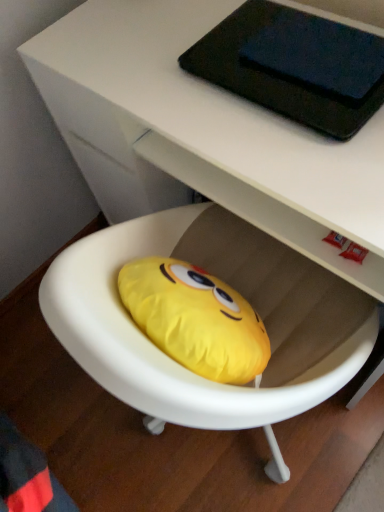
Question: Can you confirm if black matte tablet at upper center is smaller than yellow fabric bean bag at center?

Choices:
 (A) no
 (B) yes

Answer: (B)

Question: From a real-world perspective, is black matte tablet at upper center physically above yellow fabric bean bag at center?

Choices:
 (A) yes
 (B) no

Answer: (A)

Question: Is black matte tablet at upper center to the left of yellow fabric bean bag at center from the viewer's perspective?

Choices:
 (A) no
 (B) yes

Answer: (A)

Question: From a real-world perspective, is black matte tablet at upper center below yellow fabric bean bag at center?

Choices:
 (A) yes
 (B) no

Answer: (B)

Question: Is black matte tablet at upper center wider than yellow fabric bean bag at center?

Choices:
 (A) yes
 (B) no

Answer: (B)

Question: Could you tell me if black matte tablet at upper center is facing yellow fabric bean bag at center?

Choices:
 (A) no
 (B) yes

Answer: (B)

Question: Considering the relative sizes of yellow fabric bean bag at center and black matte tablet at upper center in the image provided, is yellow fabric bean bag at center wider than black matte tablet at upper center?

Choices:
 (A) no
 (B) yes

Answer: (B)

Question: From the image's perspective, would you say yellow fabric bean bag at center is shown under black matte tablet at upper center?

Choices:
 (A) no
 (B) yes

Answer: (B)

Question: From a real-world perspective, is yellow fabric bean bag at center on top of black matte tablet at upper center?

Choices:
 (A) yes
 (B) no

Answer: (B)

Question: Is the position of yellow fabric bean bag at center less distant than that of black matte tablet at upper center?

Choices:
 (A) yes
 (B) no

Answer: (A)

Question: Is yellow fabric bean bag at center next to black matte tablet at upper center?

Choices:
 (A) yes
 (B) no

Answer: (B)

Question: Is black matte tablet at upper center surrounded by yellow fabric bean bag at center?

Choices:
 (A) yes
 (B) no

Answer: (A)

Question: Considering their positions, is yellow fabric bean bag at center located in front of or behind black matte tablet at upper center?

Choices:
 (A) behind
 (B) front

Answer: (B)